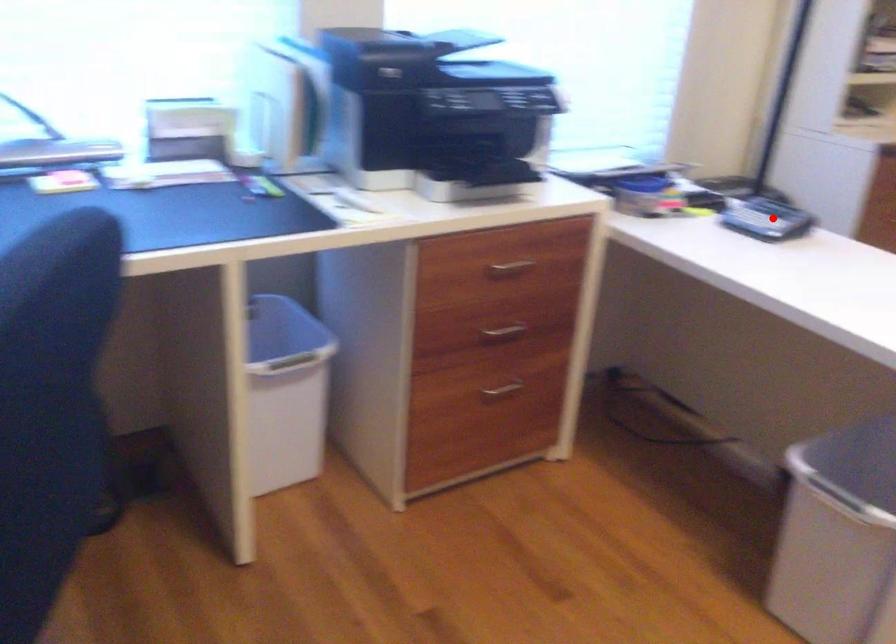
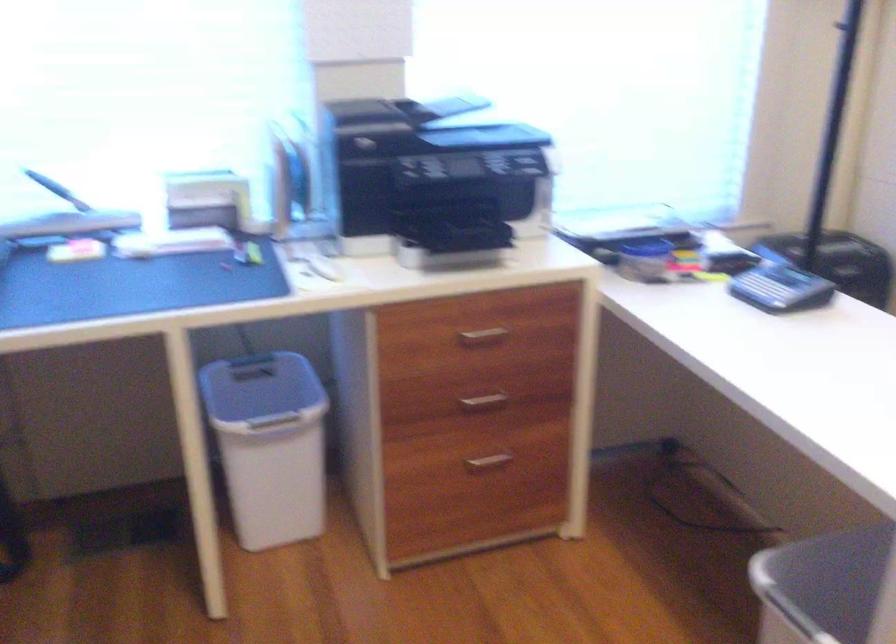
The point at the highlighted location is marked in the first image. Where is the corresponding point in the second image?

(780, 288)